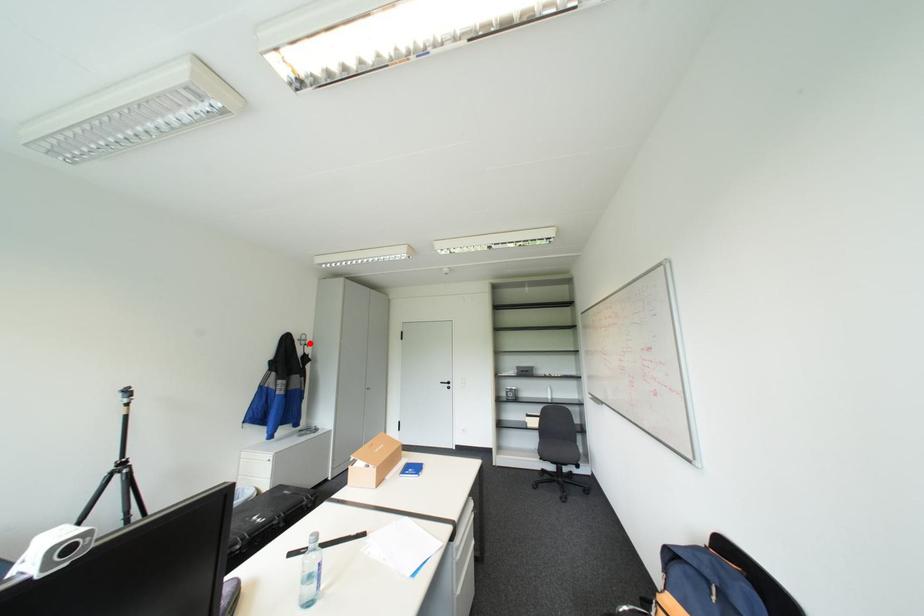
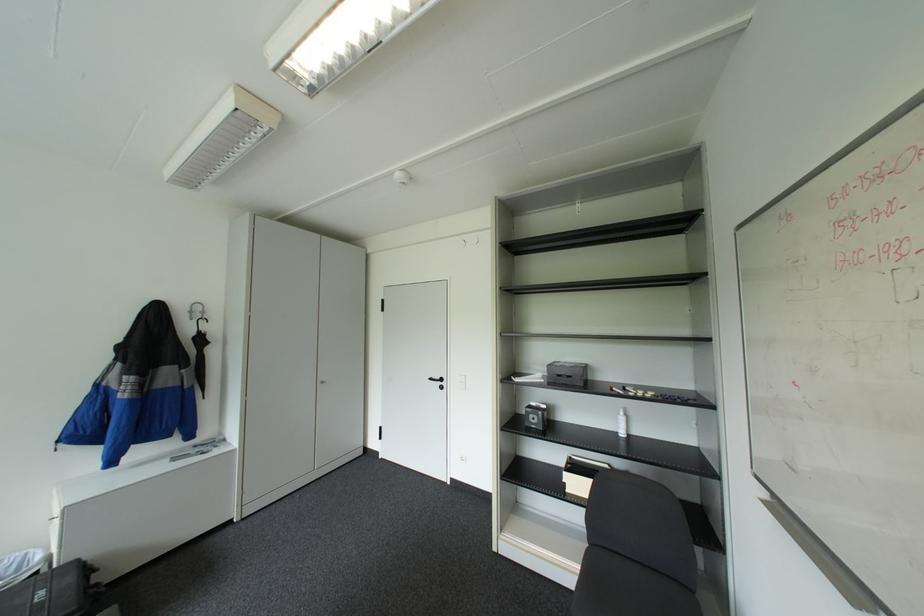
The point at the highlighted location is marked in the first image. Where is the corresponding point in the second image?

(200, 318)